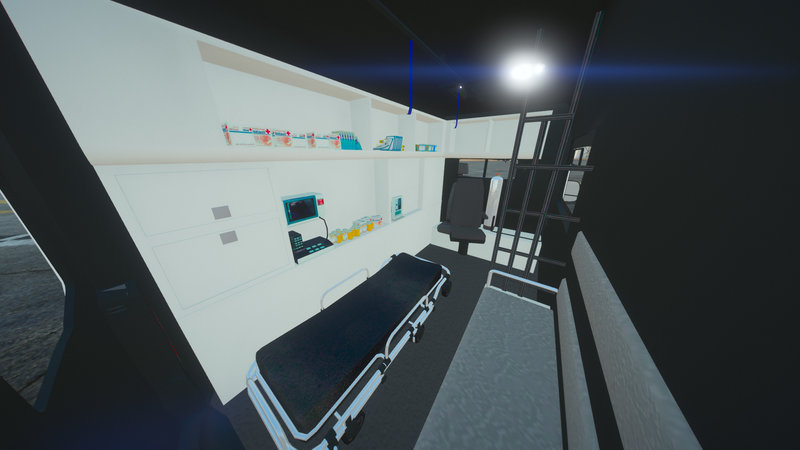
Identify the location of light source. (x=520, y=67).